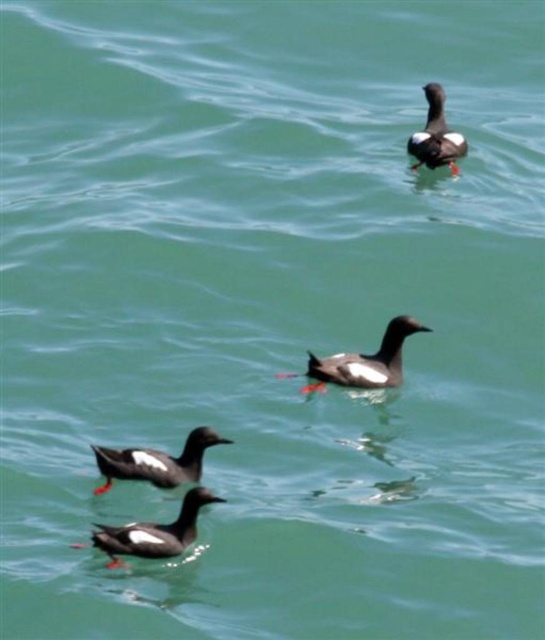
Question: Which point is closer to the camera?

Choices:
 (A) (447, 145)
 (B) (125, 477)
 (C) (154, 536)
 (D) (348, 358)

Answer: (C)

Question: Does dark brown feathers at center lie behind dark brown feathers at upper right?

Choices:
 (A) no
 (B) yes

Answer: (A)

Question: Estimate the real-world distances between objects in this image. Which object is farther from the matte black duck at lower left?

Choices:
 (A) dark brown matte duck at center
 (B) dark brown feathers at upper right

Answer: (B)

Question: Based on their relative distances, which object is nearer to the dark brown feathers at center?

Choices:
 (A) matte black duck at lower left
 (B) dark brown matte duck at center
 (C) dark brown feathers at upper right

Answer: (B)

Question: Can you confirm if dark brown matte duck at center is thinner than dark brown feathers at center?

Choices:
 (A) no
 (B) yes

Answer: (B)

Question: Is dark brown feathers at center wider than dark brown feathers at upper right?

Choices:
 (A) yes
 (B) no

Answer: (A)